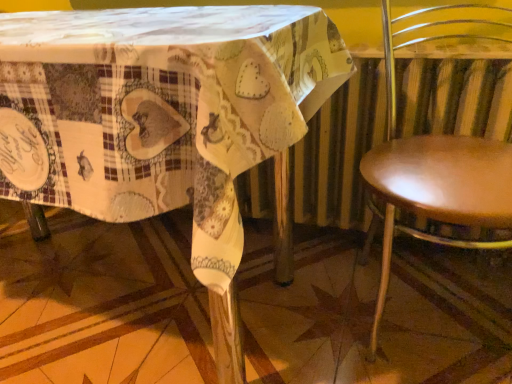
Locate an element on the screen. free spot behind shiny brown seat at right is located at coordinates [x=376, y=251].